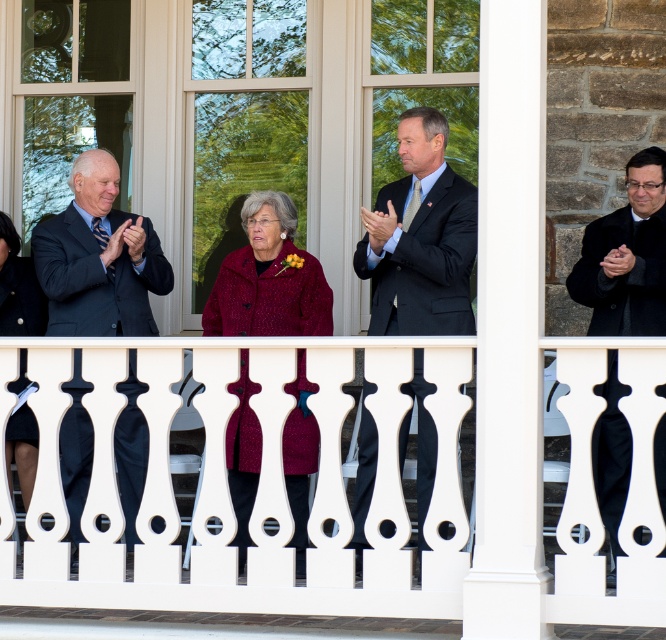
Question: Can you confirm if white painted wood railing at center is thinner than dark blue suit at left?

Choices:
 (A) yes
 (B) no

Answer: (B)

Question: Considering the real-world distances, which object is farthest from the dark blue suit at center?

Choices:
 (A) velvet burgundy coat at center
 (B) burgundy textured coat at center

Answer: (A)

Question: Is white painted wood railing at center to the right of burgundy textured coat at center from the viewer's perspective?

Choices:
 (A) no
 (B) yes

Answer: (B)

Question: Does burgundy textured coat at center appear over black matte jacket at right?

Choices:
 (A) no
 (B) yes

Answer: (A)

Question: Based on their relative distances, which object is farther from the dark blue suit at center?

Choices:
 (A) velvet burgundy coat at center
 (B) black matte jacket at right

Answer: (A)

Question: Which object is closer to the camera taking this photo?

Choices:
 (A) velvet burgundy coat at center
 (B) dark blue suit at left

Answer: (A)